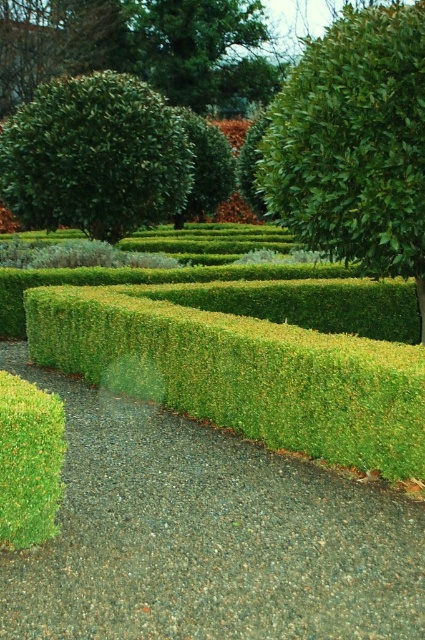
Question: Can you confirm if green gravel at center is smaller than green fuzzy bush at center?

Choices:
 (A) no
 (B) yes

Answer: (A)

Question: Which point is closer to the camera?

Choices:
 (A) green leafy bush at upper right
 (B) green leafy shrub at upper left

Answer: (A)

Question: Which point appears closest to the camera in this image?

Choices:
 (A) (36, 468)
 (B) (367, 406)

Answer: (A)

Question: Can you confirm if green leafy hedge at center is positioned to the right of green leafy bush at upper right?

Choices:
 (A) no
 (B) yes

Answer: (A)

Question: Is green gravel at center further to camera compared to green leafy bush at upper right?

Choices:
 (A) yes
 (B) no

Answer: (B)

Question: Which point is closer to the camera?

Choices:
 (A) (90, 81)
 (B) (377, 97)

Answer: (B)